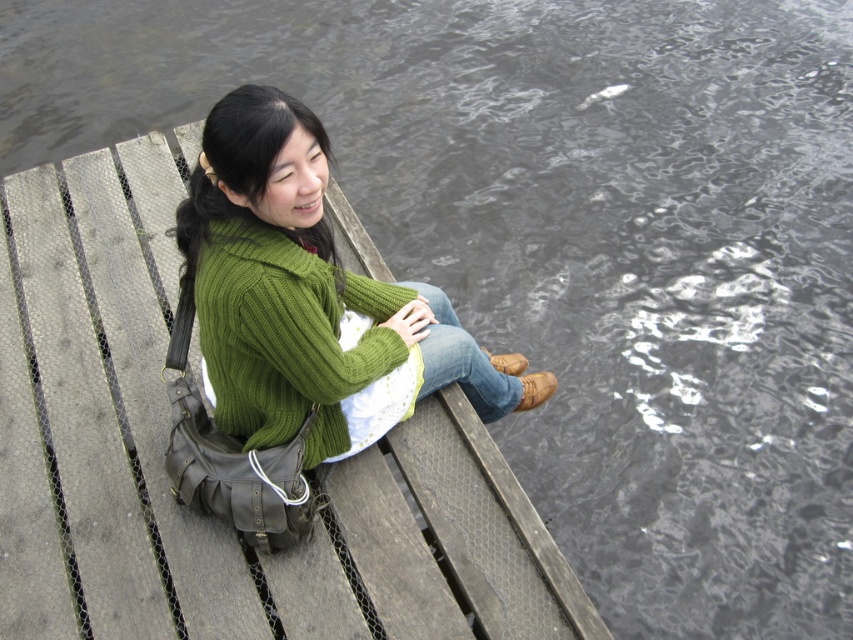
Is the position of wooden dock at center less distant than that of green knitted sweater at upper left?

No, it is behind green knitted sweater at upper left.

Find the location of a particular element. This screenshot has width=853, height=640. wooden dock at center is located at coordinates (167, 481).

Identify the location of wooden dock at center. coord(167,481).

Can you confirm if green knitted sweater at center is bigger than green knitted sweater at upper left?

Yes.

Is green knitted sweater at center smaller than green knitted sweater at upper left?

Actually, green knitted sweater at center might be larger than green knitted sweater at upper left.

Does point (442, 330) come farther from viewer compared to point (279, 403)?

Yes, it is behind point (279, 403).

You are a GUI agent. You are given a task and a screenshot of the screen. Output one action in this format:
    pyautogui.click(x=<x>, y=<y>)
    Task: Click on the green knitted sweater at center
    Image resolution: width=853 pixels, height=640 pixels.
    Given the screenshot: What is the action you would take?
    pyautogui.click(x=312, y=298)

Which of these two, wooden dock at center or green knitted sweater at center, stands taller?

Standing taller between the two is wooden dock at center.

Does point (418, 547) come in front of point (302, 380)?

No, it is not.

The width and height of the screenshot is (853, 640). I want to click on wooden dock at center, so click(x=167, y=481).